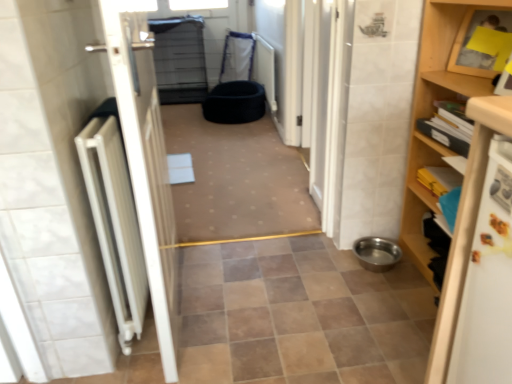
Where is `blank area beneath white matte door at left (from a real-world perspective)`? The height and width of the screenshot is (384, 512). blank area beneath white matte door at left (from a real-world perspective) is located at coordinates (185, 308).